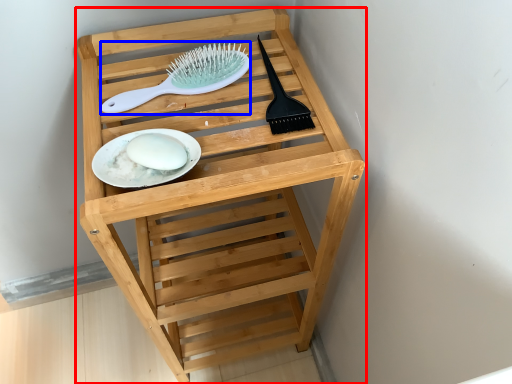
Question: Which object is further to the camera taking this photo, furniture (highlighted by a red box) or brush (highlighted by a blue box)?

Choices:
 (A) furniture
 (B) brush

Answer: (B)